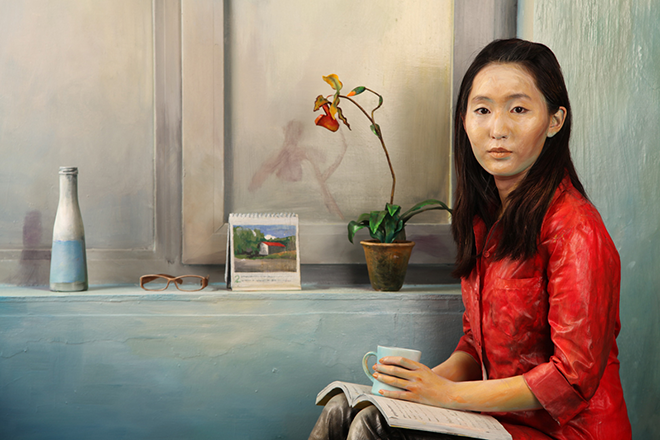
Identify the location of coffee mug. This screenshot has width=660, height=440. (385, 351).